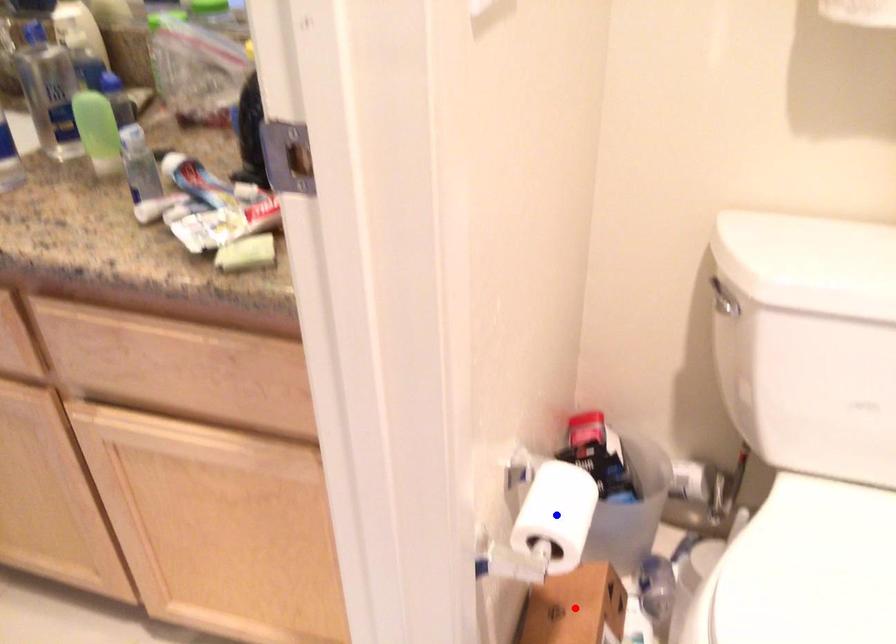
Question: Which of the two points in the image is closer to the camera?

Choices:
 (A) Blue point is closer.
 (B) Red point is closer.

Answer: (A)